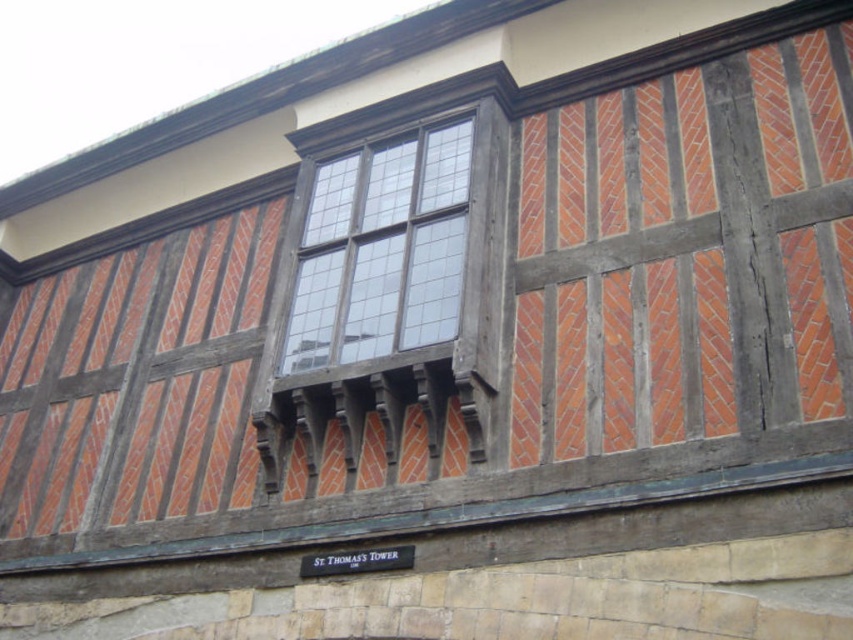
You are standing in front of the building and want to determine the relative positions of two points marked on the facade. Which point is closer to you, point (495,365) or point (358,353)?

Point (495,365) is closer to the viewer than point (358,353).

You are an architect analyzing the building facade. You notice the dark brown wood at center and the clear glass window at center. Which object is positioned to the right side of the other?

The dark brown wood at center is to the right of the clear glass window at center.

You are an architect analyzing the building facade. You notice the dark brown wood at center and the clear glass window at center. Which of these two elements has a greater vertical height in the image?

The dark brown wood at center is much taller than the clear glass window at center, so the dark brown wood at center has a greater vertical height.